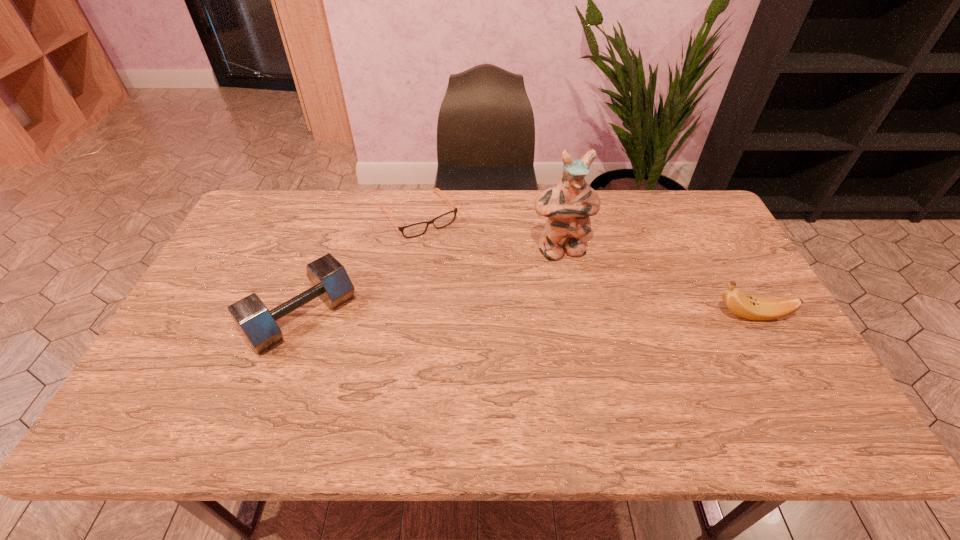
Locate an element on the screen. This screenshot has height=540, width=960. dumbbell is located at coordinates (331, 283).

At what (x,y) coordinates should I click in order to perform the action: click on banana. Please return your answer as a coordinate pair (x, y). Looking at the image, I should click on (754, 308).

This screenshot has height=540, width=960. Find the location of `spectacles`. spectacles is located at coordinates (417, 229).

Where is `figurine`? This screenshot has height=540, width=960. figurine is located at coordinates (568, 206).

Locate an element on the screen. This screenshot has height=540, width=960. the tallest object is located at coordinates (568, 206).

The image size is (960, 540). What are the coordinates of `vacant space situated 0.370m on the back of the dumbbell` in the screenshot? It's located at (343, 203).

At what (x,y) coordinates should I click in order to perform the action: click on free space located on the left of the rightmost object. Please return your answer as a coordinate pair (x, y). Looking at the image, I should click on (620, 315).

Identify the location of free space located on the front-facing side of the shortest object. This screenshot has width=960, height=540. (496, 319).

The height and width of the screenshot is (540, 960). In order to click on vacant area located 0.350m on the front-facing side of the shortest object in this screenshot , I will do `click(491, 312)`.

Locate an element on the screen. The image size is (960, 540). vacant space situated 0.130m on the front-facing side of the shortest object is located at coordinates (454, 262).